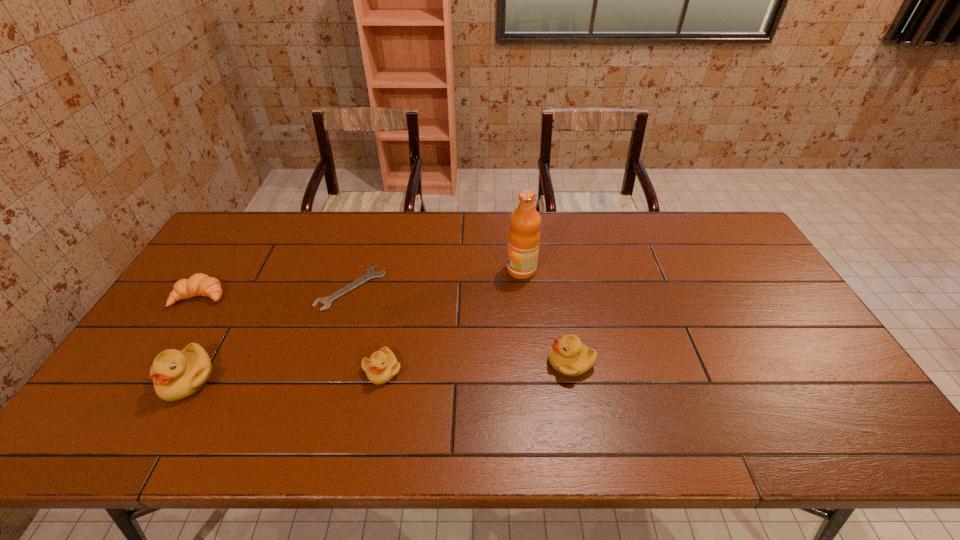
Identify the location of free spot that satisfies the following two spatial constraints: 1. on the front-facing side of the second shortest duckling; 2. on the front-facing side of the fifth shortest object. The height and width of the screenshot is (540, 960). (574, 379).

I want to click on vacant region that satisfies the following two spatial constraints: 1. on the front-facing side of the second shortest duckling; 2. on the front-facing side of the leftmost duckling, so click(574, 379).